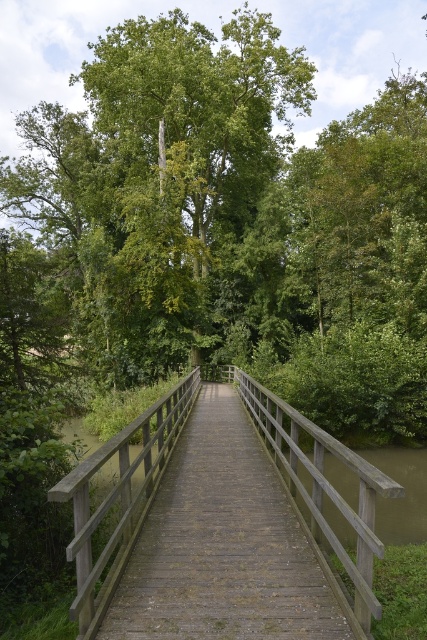
Can you confirm if green leafy tree at center is positioned to the right of wooden bridge at center?

No, green leafy tree at center is not to the right of wooden bridge at center.

Is green leafy tree at center behind wooden bridge at center?

Yes, it is.

Image resolution: width=427 pixels, height=640 pixels. What are the coordinates of `green leafy tree at center` in the screenshot? It's located at (233, 218).

Find the location of a particular element. The width and height of the screenshot is (427, 640). green leafy tree at center is located at coordinates (233, 218).